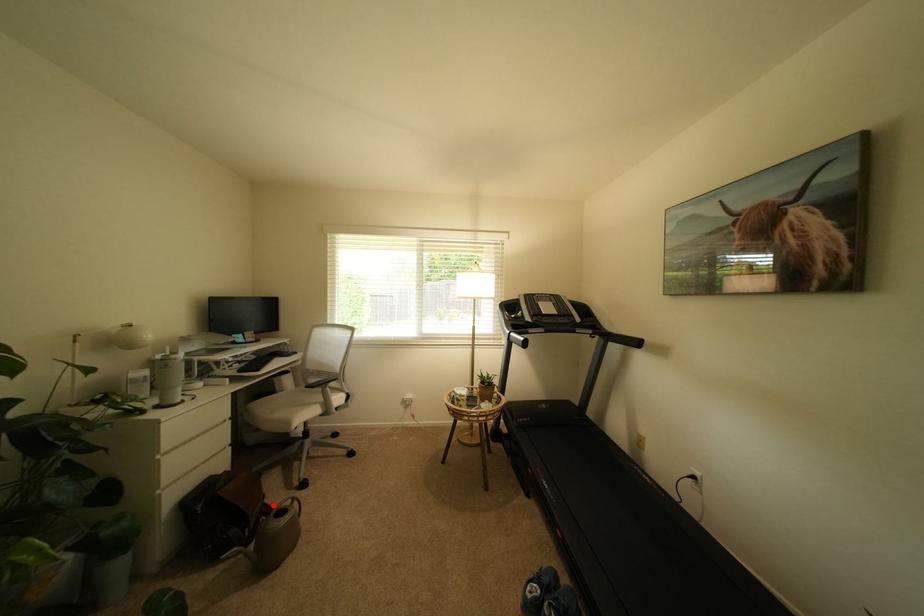
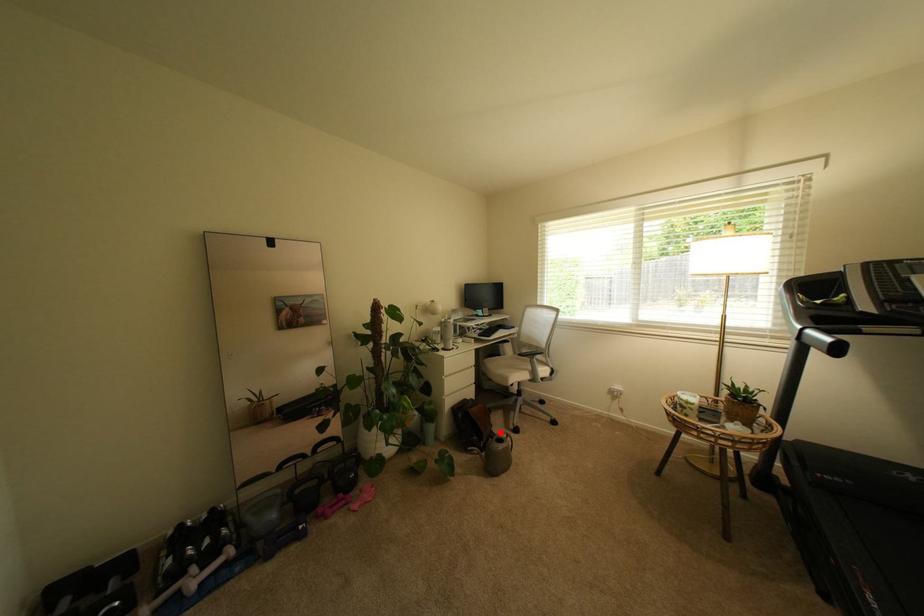
I am providing you with two images of the same scene from different viewpoints. A red point is marked on the first image and another point is marked on the second image. Do the highlighted points in image1 and image2 indicate the same real-world spot?

Yes